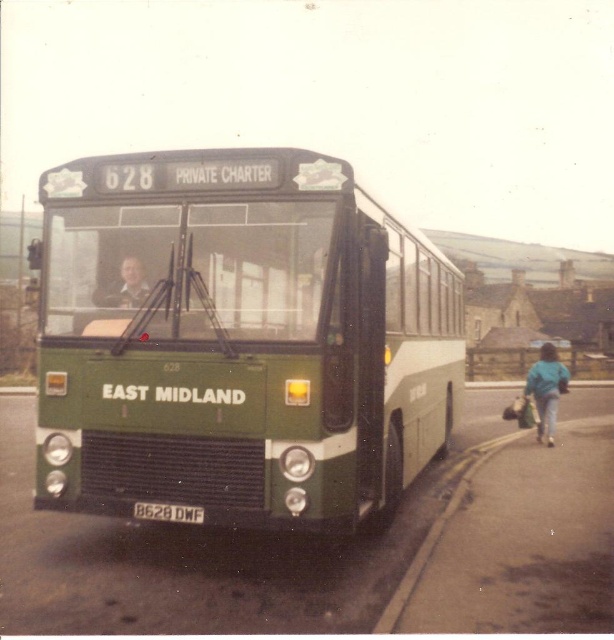
Who is more forward, (134, 321) or (130, 292)?

Positioned in front is point (134, 321).

Who is taller, green matte bus at center or matte green face at center?

green matte bus at center is taller.

Which is in front, point (56, 396) or point (119, 296)?

Point (119, 296) is more forward.

What are the coordinates of `green matte bus at center` in the screenshot? It's located at (238, 339).

Which is below, blue fabric jacket at lower right or matte green face at center?

blue fabric jacket at lower right

Based on the photo, who is positioned more to the right, blue fabric jacket at lower right or matte green face at center?

blue fabric jacket at lower right

Is point (556, 380) in front of point (134, 260)?

No, (556, 380) is behind (134, 260).

Locate an element on the screen. blue fabric jacket at lower right is located at coordinates (546, 388).

Between point (169, 316) and point (550, 413), which one is positioned behind?

Point (550, 413)

Who is positioned more to the right, green matte bus at center or blue fabric jacket at lower right?

From the viewer's perspective, blue fabric jacket at lower right appears more on the right side.

Is point (276, 321) closer to camera compared to point (554, 396)?

That is True.

Find the location of a particular element. This screenshot has width=614, height=640. green matte bus at center is located at coordinates (238, 339).